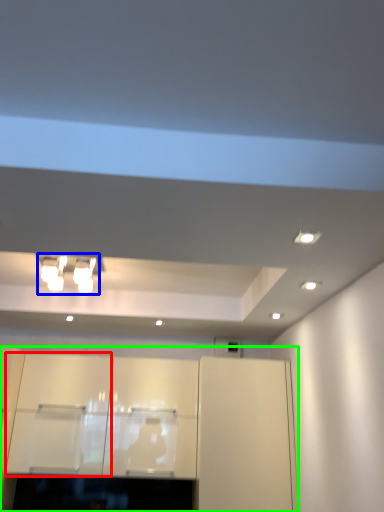
Question: Based on their relative distances, which object is nearer to cabinetry (highlighted by a red box)? Choose from light fixture (highlighted by a blue box) and cabinetry (highlighted by a green box).

Choices:
 (A) light fixture
 (B) cabinetry

Answer: (B)